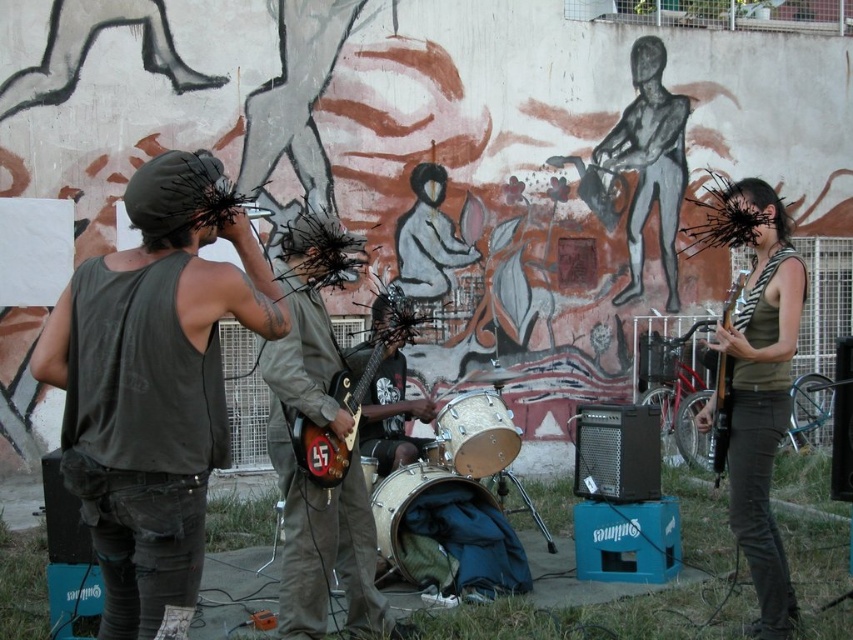
Between matte brown guitar at center and black matte hair at upper right, which one has more height?

matte brown guitar at center

Does matte brown guitar at center have a lesser height compared to black matte hair at upper right?

In fact, matte brown guitar at center may be taller than black matte hair at upper right.

Is point (321, 604) positioned behind point (747, 202)?

No, it is not.

You are a GUI agent. You are given a task and a screenshot of the screen. Output one action in this format:
    pyautogui.click(x=<x>, y=<y>)
    Task: Click on the matte brown guitar at center
    The height and width of the screenshot is (640, 853).
    Given the screenshot: What is the action you would take?
    pyautogui.click(x=310, y=480)

Can you confirm if dark green sleeveless shirt at left is positioned above camouflage fabric drum at center?

Indeed, dark green sleeveless shirt at left is positioned over camouflage fabric drum at center.

Between dark green sleeveless shirt at left and camouflage fabric drum at center, which one has less height?

camouflage fabric drum at center

This screenshot has height=640, width=853. What do you see at coordinates (154, 387) in the screenshot?
I see `dark green sleeveless shirt at left` at bounding box center [154, 387].

The width and height of the screenshot is (853, 640). I want to click on dark green sleeveless shirt at left, so click(x=154, y=387).

Is matte brown guitar at center thinner than glossy wood guitar at center?

In fact, matte brown guitar at center might be wider than glossy wood guitar at center.

From the picture: Who is positioned more to the right, matte brown guitar at center or glossy wood guitar at center?

glossy wood guitar at center

Identify the location of matte brown guitar at center. This screenshot has width=853, height=640. (310, 480).

You are a GUI agent. You are given a task and a screenshot of the screen. Output one action in this format:
    pyautogui.click(x=<x>, y=<y>)
    Task: Click on the matte brown guitar at center
    The width and height of the screenshot is (853, 640).
    Given the screenshot: What is the action you would take?
    pyautogui.click(x=310, y=480)